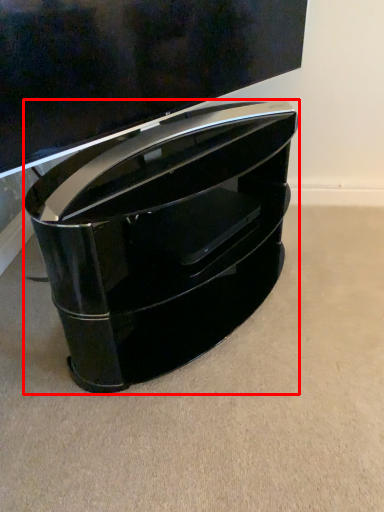
Question: Considering the relative positions of furniture (annotated by the red box) and television in the image provided, where is furniture (annotated by the red box) located with respect to the staircase?

Choices:
 (A) right
 (B) left

Answer: (B)